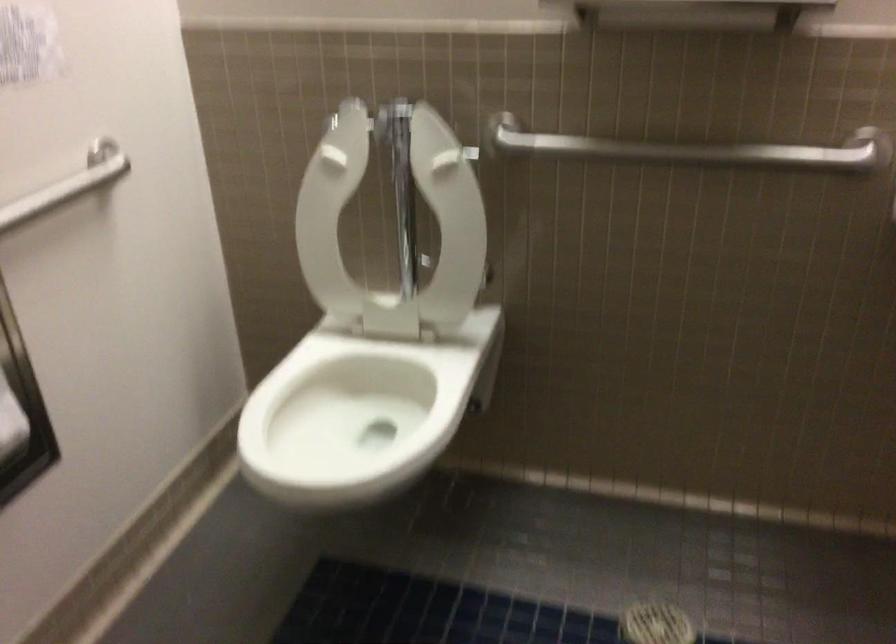
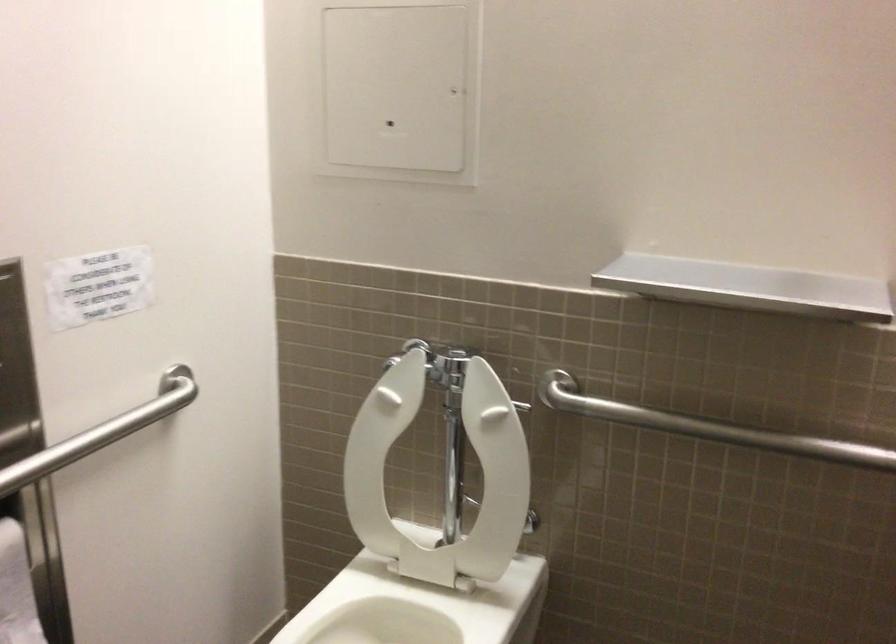
In the second image, find the point that corresponds to [656,144] in the first image.

(709, 427)